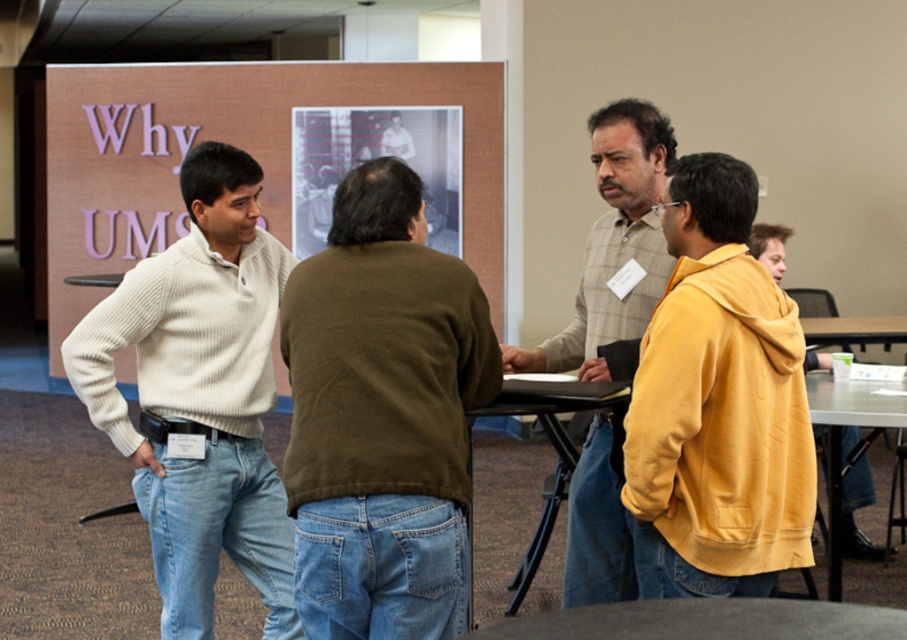
Question: Which point is farther to the camera?

Choices:
 (A) metallic silver table at lower right
 (B) matte yellow hoodie at right
 (C) white ribbed sweater at left
 (D) smooth gray table at lower center

Answer: (A)

Question: Does metallic silver table at lower right appear under yellow fleece jacket at right?

Choices:
 (A) no
 (B) yes

Answer: (A)

Question: Which object is the closest to the yellow fleece jacket at right?

Choices:
 (A) matte yellow hoodie at right
 (B) light brown plaid shirt at center
 (C) metallic silver table at lower right
 (D) metallic gray table at center

Answer: (C)

Question: Does metallic gray table at center appear on the left side of metallic silver table at lower right?

Choices:
 (A) yes
 (B) no

Answer: (A)

Question: In this image, where is dark brown sweater at center located relative to metallic gray table at center?

Choices:
 (A) right
 (B) left

Answer: (B)

Question: Which is farther from the matte yellow hoodie at right?

Choices:
 (A) yellow fleece jacket at right
 (B) smooth gray table at lower center

Answer: (A)